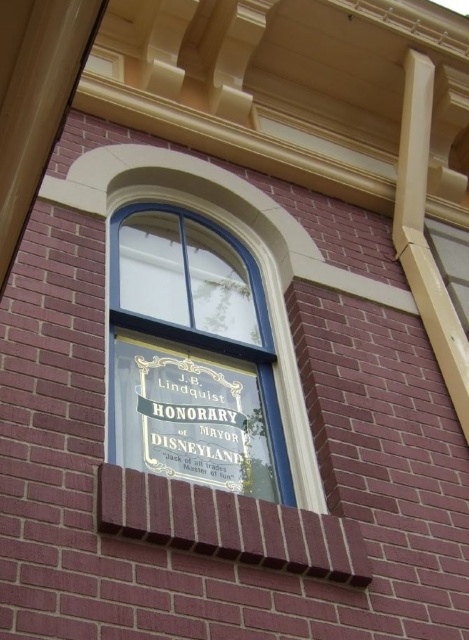
You are an architect reviewing the building facade. You notice the gold metallic plaque at center and the transparent glass window at center. Which object occupies more space on the wall?

The gold metallic plaque at center has a larger size compared to the transparent glass window at center, so it occupies more space on the wall.

You are an architect examining the building facade. You notice a gold metallic plaque at center. Based on the coordinates provided, can you determine its position relative to the window frame?

The gold metallic plaque at center is located at coordinates point [190,417], which places it to the right side and slightly below the center of the window frame.